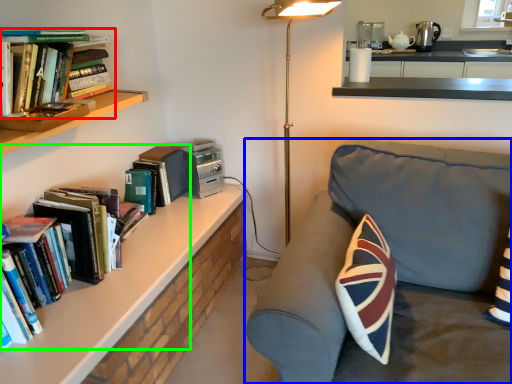
Question: Considering the real-world distances, which object is farthest from book (highlighted by a red box)? studio couch (highlighted by a blue box) or book (highlighted by a green box)?

Choices:
 (A) studio couch
 (B) book

Answer: (A)